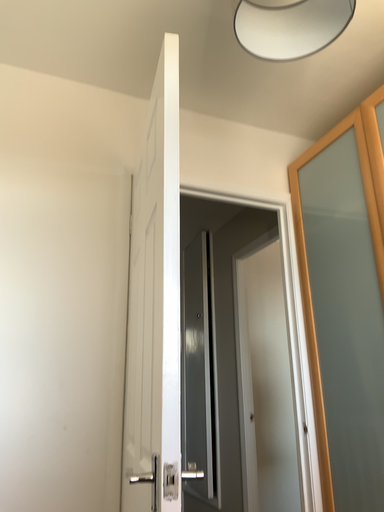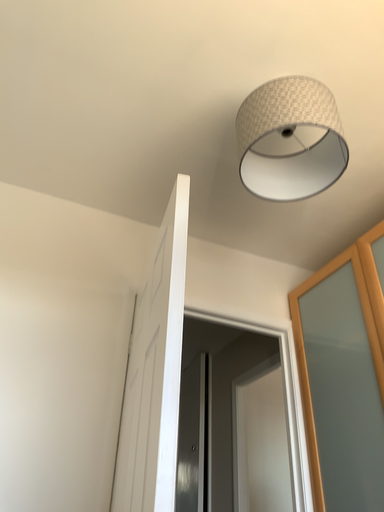
Question: Which way did the camera rotate in the video?

Choices:
 (A) rotated upward
 (B) rotated downward

Answer: (A)